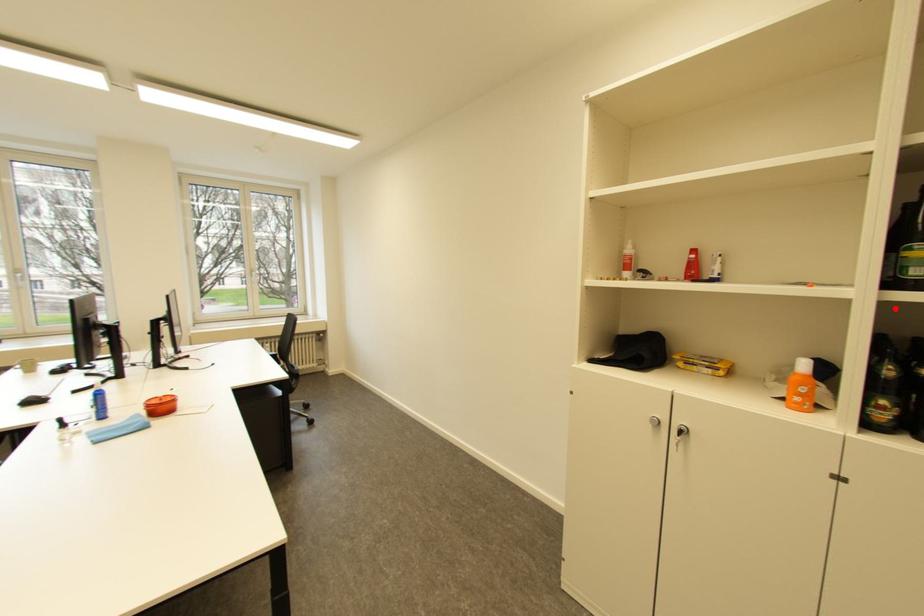
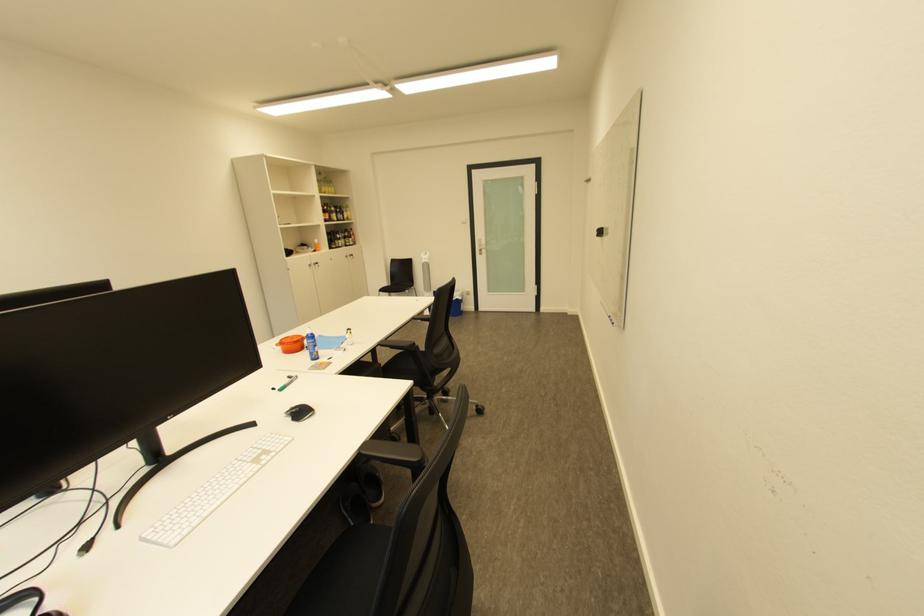
Question: I am providing you with two images of the same scene from different viewpoints. A red point is shown in image1. For the corresponding object point in image2, is it positioned nearer or farther from the camera?

Choices:
 (A) Nearer
 (B) Farther

Answer: (A)